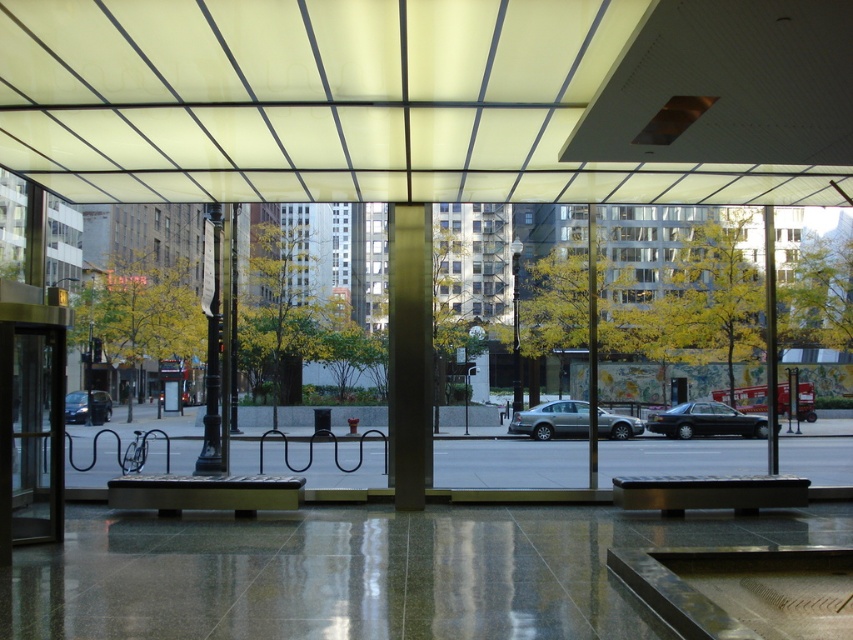
You are standing inside the building and want to locate the matte glass canopy at upper center. According to the coordinates provided, where should you look relative to the center of the image?

The matte glass canopy at upper center is located at coordinates point (430, 99), which means it is slightly to the left and exactly at the center vertically relative to the image center.

You are a window cleaner standing at the camera position. You need to clean the matte glass canopy at upper center. Can you reach it using a 5 meter long pole?

The matte glass canopy at upper center is 5.04 meters away from camera. Since the pole is only 5 meters long, it is 4 centimeters too short to reach the canopy.

You are standing inside the building and looking through the large glass windows. You notice two points marked on the glass at coordinates point (398, 244) and point (672, 426). Which point appears closer to you when looking through the window?

Point (398, 244) is in front of point (672, 426), so it appears closer to you when looking through the window.